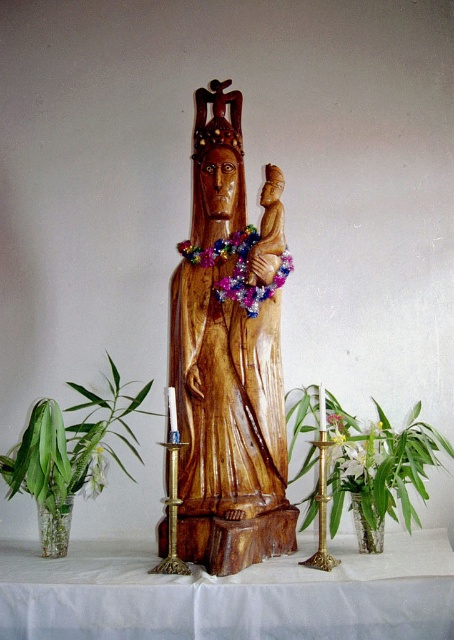
Question: Which object is farther from the camera taking this photo?

Choices:
 (A) gold metallic candle holder at center
 (B) wooden statue at center
 (C) green glass vase at left

Answer: (C)

Question: Which of the following is the closest to the observer?

Choices:
 (A) (340, 486)
 (B) (49, 572)
 (C) (171, 554)
 (D) (236, 128)

Answer: (B)

Question: Which object appears farthest from the camera in this image?

Choices:
 (A) green leafy plant at lower right
 (B) white glossy flower at center right
 (C) white cloth table at center

Answer: (B)

Question: Can you confirm if wooden statue at center is positioned below gold polished candlestick at center?

Choices:
 (A) no
 (B) yes

Answer: (A)

Question: Does white cloth table at center appear on the left side of green glass vase at left?

Choices:
 (A) no
 (B) yes

Answer: (A)

Question: Considering the relative positions of green leafy plant at lower right and gold metallic candle holder at center in the image provided, where is green leafy plant at lower right located with respect to gold metallic candle holder at center?

Choices:
 (A) above
 (B) below

Answer: (A)